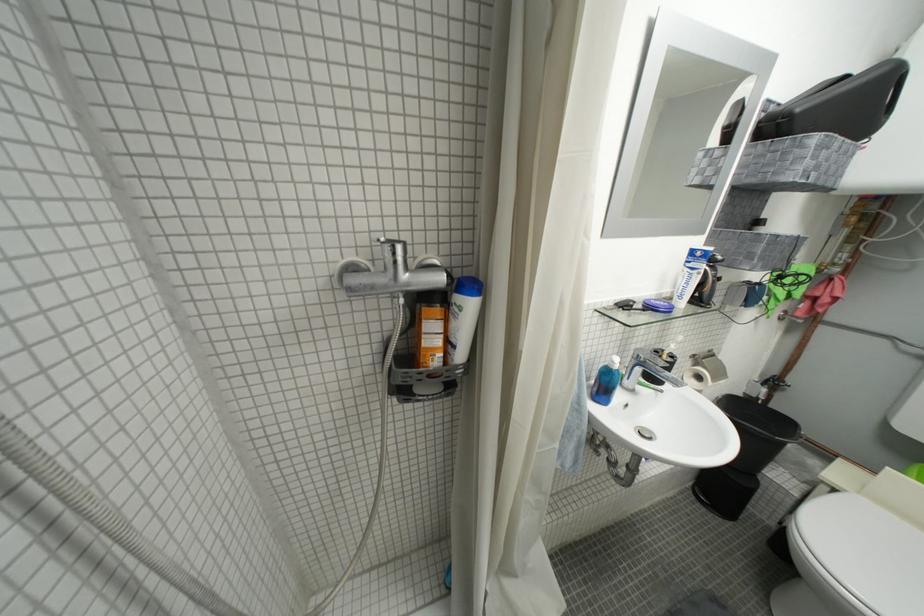
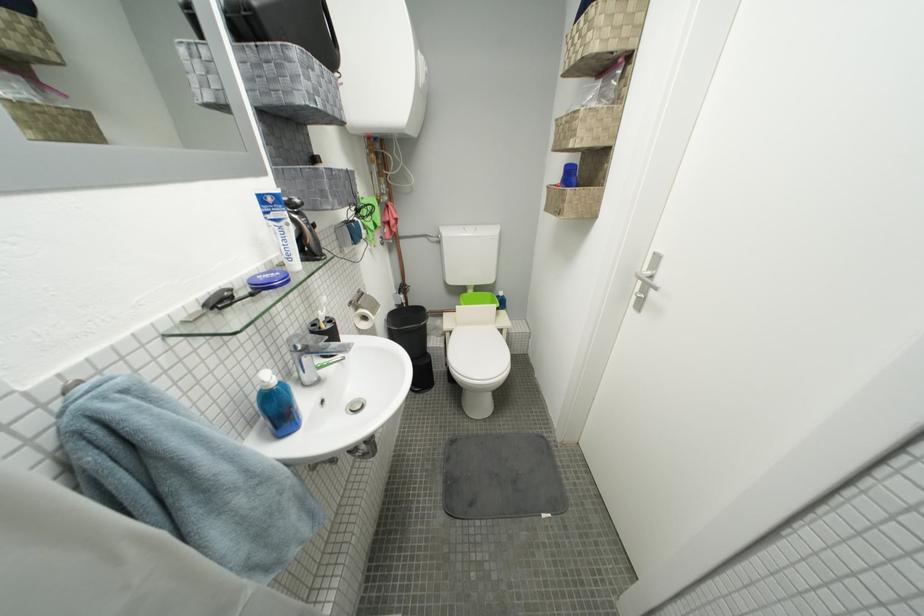
How did the camera likely rotate?

The camera's rotation is toward right-down.